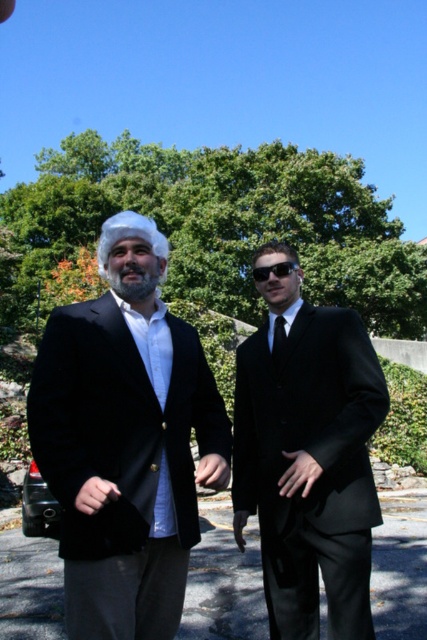
You are standing in a park and see two people. The first person is wearing a black suit jacket over a white collared shirt and gray trousers, with a white curly wig and raised hands. The second person is in a black suit without a wig, has dark sunglasses and a beard, and hands near their waist. There is a point at coordinates (362,330). If you want to reach that point, which direction should you move relative to the two people?

The point at coordinates (362,330) is 9.05 feet away from the viewer, so you should move forward towards the direction where the two people are located to reach it.

You are a photographer who needs to adjust the lighting for a portrait. You have a reflector that can be placed at point A or point B. Point A is at coordinates 0.6, 0.6 and point B is at 0.8, 0.8. Which point would reflect light better onto the black velvet suit at right?

The reflector placed at point B at (341, 512) is closer to the black velvet suit at right located at (309, 461), so it would reflect light better onto the black velvet suit at right.